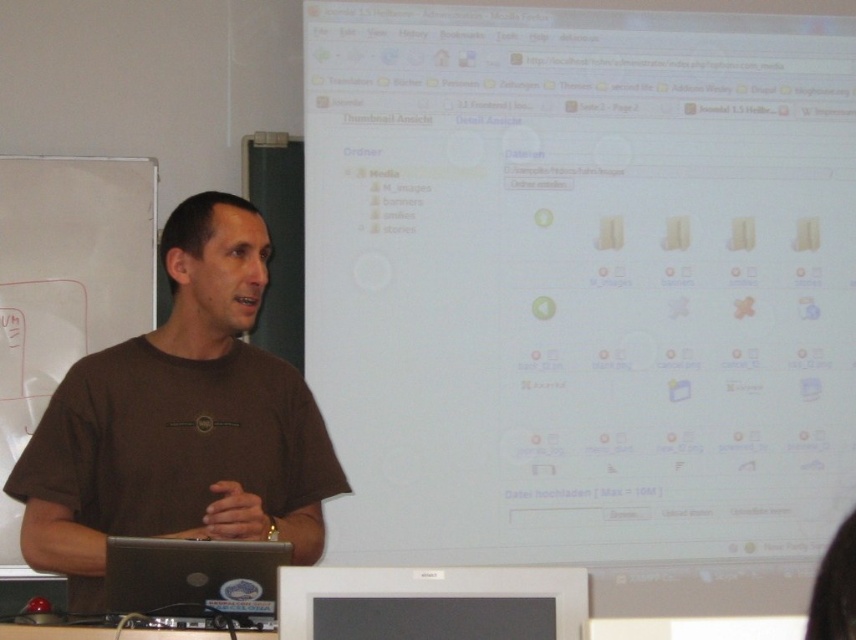
You are a photographer setting up for a presentation. You need to ensure that both the brown cotton shirt at center and the black glossy monitor at lower center are visible in your shot. Which object should you position closer to the left side of the frame to achieve this?

The brown cotton shirt at center is positioned on the left side of the black glossy monitor at lower center, so to have both visible, position the brown cotton shirt at center closer to the left side of the frame.

You are an assistant who needs to set up a presentation. You have a black glossy monitor at lower center and a black plastic laptop at lower left. Which device should you use if you need a larger screen for your presentation?

The black glossy monitor at lower center is bigger than the black plastic laptop at lower left, so you should use the black glossy monitor at lower center for a larger screen.

You are a presenter standing at the front of the room. You need to adjust the focus of your projector to ensure both the white glossy screen at upper center and the black glossy monitor at lower center are clearly visible. Which object should you adjust the focus for first, based on their positions?

You should adjust the focus for the white glossy screen at upper center first because it is closer to you than the black glossy monitor at lower center, so focusing on the closer object first ensures clarity for both.